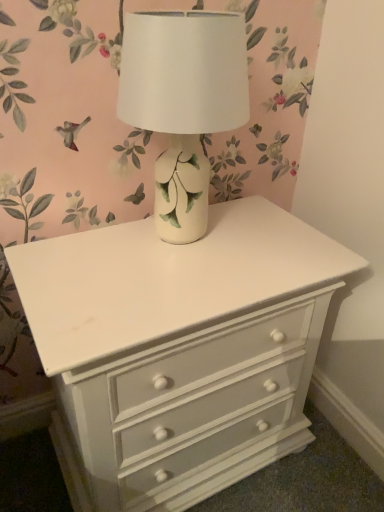
Describe the element at coordinates (179, 350) in the screenshot. The height and width of the screenshot is (512, 384). I see `white painted wood chest of drawers at center` at that location.

Where is `white painted wood chest of drawers at center`? The image size is (384, 512). white painted wood chest of drawers at center is located at coordinates (179, 350).

The width and height of the screenshot is (384, 512). Describe the element at coordinates (183, 103) in the screenshot. I see `white ceramic table lamp at center` at that location.

What is the approximate width of white ceramic table lamp at center?

25.12 centimeters.

This screenshot has height=512, width=384. I want to click on white ceramic table lamp at center, so click(183, 103).

Image resolution: width=384 pixels, height=512 pixels. I want to click on white painted wood chest of drawers at center, so click(x=179, y=350).

Considering the positions of objects white ceramic table lamp at center and white painted wood chest of drawers at center in the image provided, who is more to the left, white ceramic table lamp at center or white painted wood chest of drawers at center?

white ceramic table lamp at center.

Which object is more forward, white ceramic table lamp at center or white painted wood chest of drawers at center?

white ceramic table lamp at center.

Does point (197, 33) come in front of point (153, 284)?

That is True.

From the image's perspective, which one is positioned lower, white ceramic table lamp at center or white painted wood chest of drawers at center?

white painted wood chest of drawers at center.

From a real-world perspective, is white ceramic table lamp at center physically located above or below white painted wood chest of drawers at center?

white ceramic table lamp at center is above white painted wood chest of drawers at center.

Which of these two, white ceramic table lamp at center or white painted wood chest of drawers at center, is thinner?

white ceramic table lamp at center.

Is white ceramic table lamp at center taller or shorter than white painted wood chest of drawers at center?

Clearly, white ceramic table lamp at center is shorter compared to white painted wood chest of drawers at center.

Is white ceramic table lamp at center bigger than white painted wood chest of drawers at center?

Actually, white ceramic table lamp at center might be smaller than white painted wood chest of drawers at center.

Can we say white ceramic table lamp at center lies outside white painted wood chest of drawers at center?

That's correct, white ceramic table lamp at center is outside of white painted wood chest of drawers at center.

Is white ceramic table lamp at center positioned far away from white painted wood chest of drawers at center?

No, there isn't a large distance between white ceramic table lamp at center and white painted wood chest of drawers at center.

Is white ceramic table lamp at center oriented towards white painted wood chest of drawers at center?

No, white ceramic table lamp at center does not turn towards white painted wood chest of drawers at center.

What's the angular difference between white ceramic table lamp at center and white painted wood chest of drawers at center's facing directions?

They differ by 0.163 degrees in their facing directions.

Could you measure the distance between white ceramic table lamp at center and white painted wood chest of drawers at center?

white ceramic table lamp at center is 12.07 inches away from white painted wood chest of drawers at center.

This screenshot has width=384, height=512. Identify the location of chest of drawers on the right of white ceramic table lamp at center. 179,350.

Would you say white painted wood chest of drawers at center is to the left or to the right of white ceramic table lamp at center in the picture?

white painted wood chest of drawers at center is to the right of white ceramic table lamp at center.

Which object is closer to the camera, white painted wood chest of drawers at center or white ceramic table lamp at center?

white ceramic table lamp at center.

Is point (17, 254) closer to viewer compared to point (135, 44)?

No, (17, 254) is further to viewer.

From the image's perspective, does white painted wood chest of drawers at center appear higher than white ceramic table lamp at center?

Incorrect, from the image's perspective, white painted wood chest of drawers at center is lower than white ceramic table lamp at center.

From a real-world perspective, is white painted wood chest of drawers at center beneath white ceramic table lamp at center?

Correct, in the physical world, white painted wood chest of drawers at center is lower than white ceramic table lamp at center.

Can you confirm if white painted wood chest of drawers at center is thinner than white ceramic table lamp at center?

No.

Which of these two, white painted wood chest of drawers at center or white ceramic table lamp at center, stands taller?

white painted wood chest of drawers at center is taller.

Between white painted wood chest of drawers at center and white ceramic table lamp at center, which one has larger size?

white painted wood chest of drawers at center.

Is white painted wood chest of drawers at center not within white ceramic table lamp at center?

Yes, white painted wood chest of drawers at center is outside of white ceramic table lamp at center.

Would you consider white painted wood chest of drawers at center to be distant from white ceramic table lamp at center?

No, white painted wood chest of drawers at center is in close proximity to white ceramic table lamp at center.

Is white painted wood chest of drawers at center oriented away from white ceramic table lamp at center?

→ No, white painted wood chest of drawers at center is not facing away from white ceramic table lamp at center.

How far apart are white painted wood chest of drawers at center and white ceramic table lamp at center?

12.07 inches.

The height and width of the screenshot is (512, 384). What are the coordinates of `the chest of drawers that appears below the white ceramic table lamp at center (from the image's perspective)` in the screenshot? It's located at (179, 350).

What are the coordinates of `chest of drawers on the right of white ceramic table lamp at center` in the screenshot? It's located at (179, 350).

Where is `the chest of drawers that is below the white ceramic table lamp at center (from the image's perspective)`? This screenshot has height=512, width=384. the chest of drawers that is below the white ceramic table lamp at center (from the image's perspective) is located at coordinates (179, 350).